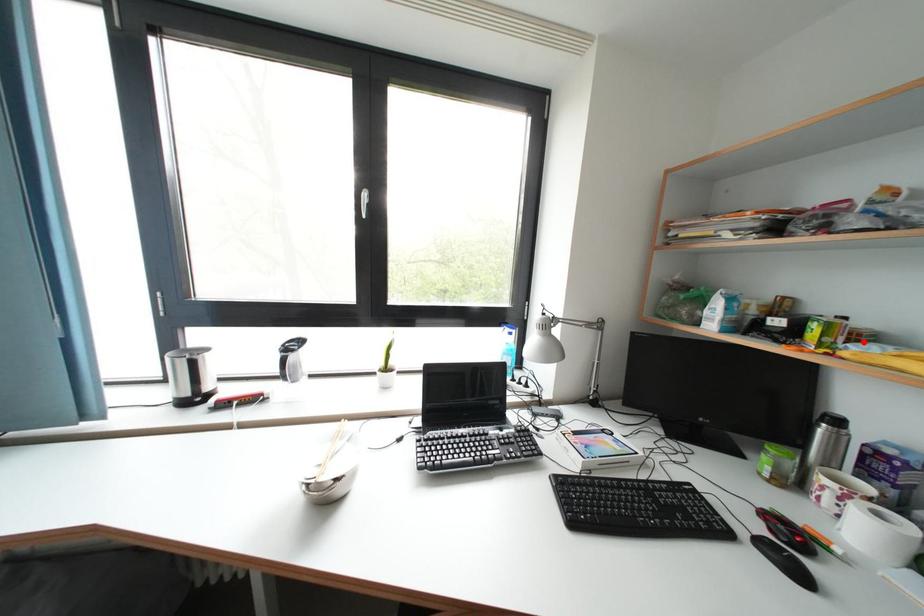
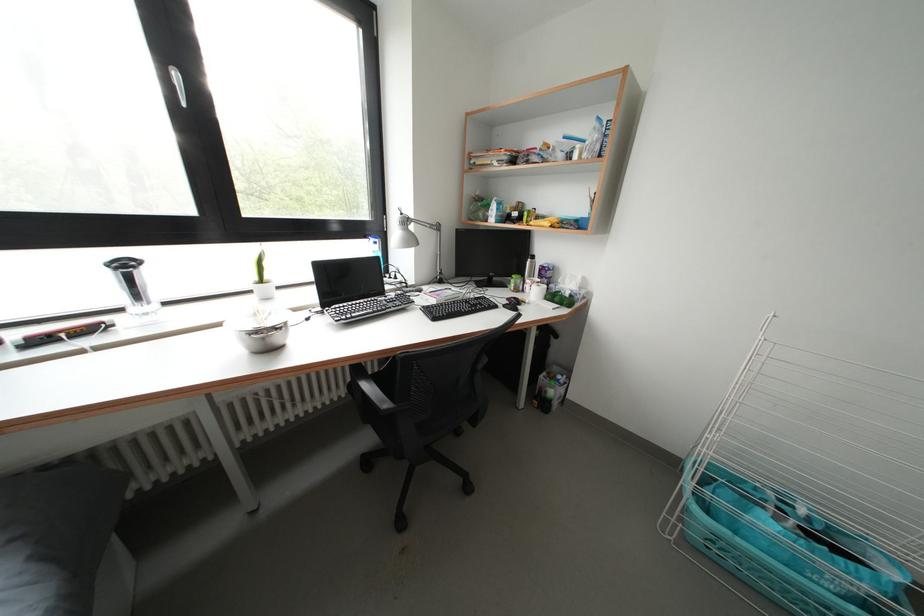
Question: I am providing you with two images of the same scene from different viewpoints. Given a red point in image1, look at the same physical point in image2. Is it:

Choices:
 (A) Closer to the viewpoint
 (B) Farther from the viewpoint

Answer: (A)